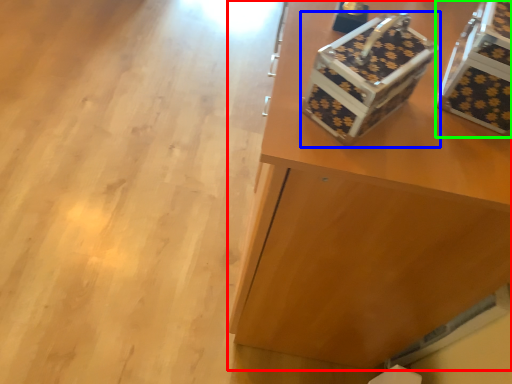
Question: Considering the real-world distances, which object is farthest from furniture (highlighted by a red box)? shoe box (highlighted by a blue box) or storage box (highlighted by a green box)?

Choices:
 (A) shoe box
 (B) storage box

Answer: (B)